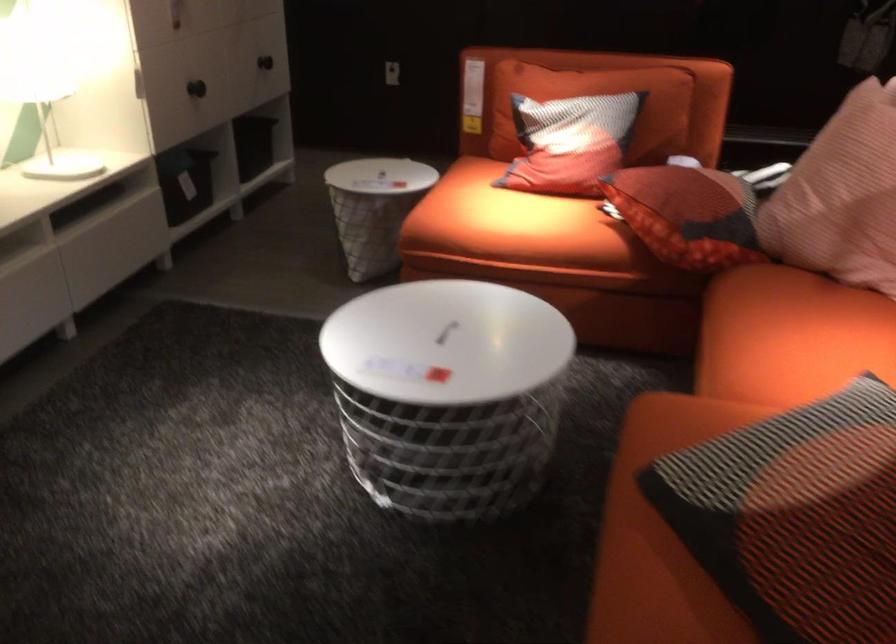
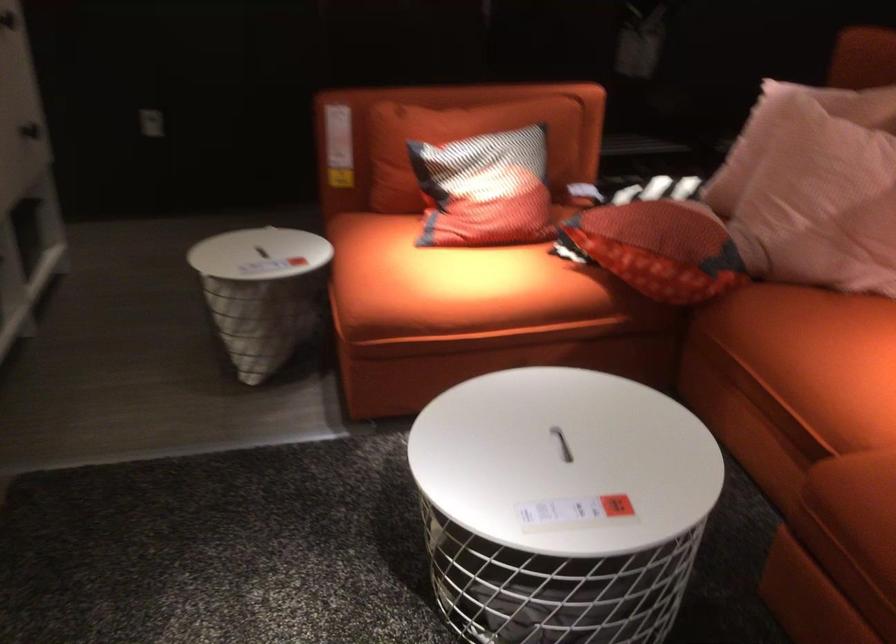
Locate, in the second image, the point that corresponds to point 496,216 in the first image.

(449, 281)